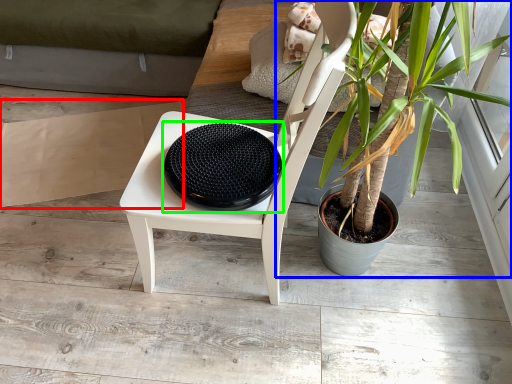
Question: Estimate the real-world distances between objects in this image. Which object is closer to cardboard (highlighted by a red box), houseplant (highlighted by a blue box) or manhole cover (highlighted by a green box)?

Choices:
 (A) houseplant
 (B) manhole cover

Answer: (B)